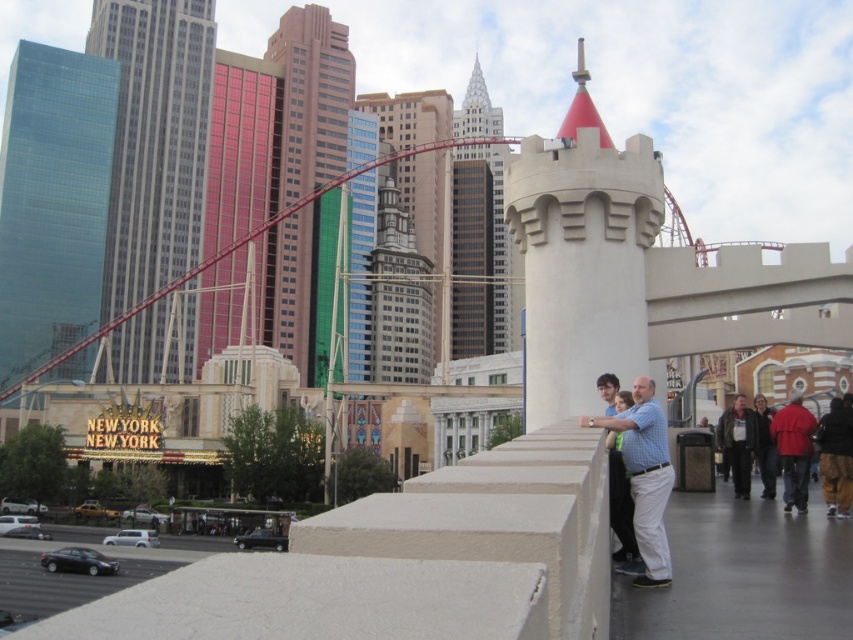
Who is lower down, white stone tower at center or red matte jacket at right?

Positioned lower is red matte jacket at right.

Is point (380, 120) positioned after point (798, 497)?

Yes, it is behind point (798, 497).

Locate an element on the screen. The width and height of the screenshot is (853, 640). white stone tower at center is located at coordinates 427,202.

Is point (408, 172) positioned before point (828, 410)?

No, it is not.

You are a GUI agent. You are given a task and a screenshot of the screen. Output one action in this format:
    pyautogui.click(x=<x>, y=<y>)
    Task: Click on the white stone tower at center
    
    Given the screenshot: What is the action you would take?
    pyautogui.click(x=427, y=202)

Who is more forward, [428,106] or [804,486]?

Positioned in front is point [804,486].

In order to click on white stone tower at center in this screenshot , I will do `click(427, 202)`.

Is metallic glass skyscraper at center closer to the viewer compared to glassy steel skyscraper at center?

Yes.

Between metallic glass skyscraper at center and glassy steel skyscraper at center, which one is positioned higher?

glassy steel skyscraper at center is above.

Identify the location of metallic glass skyscraper at center. The image size is (853, 640). (311, 97).